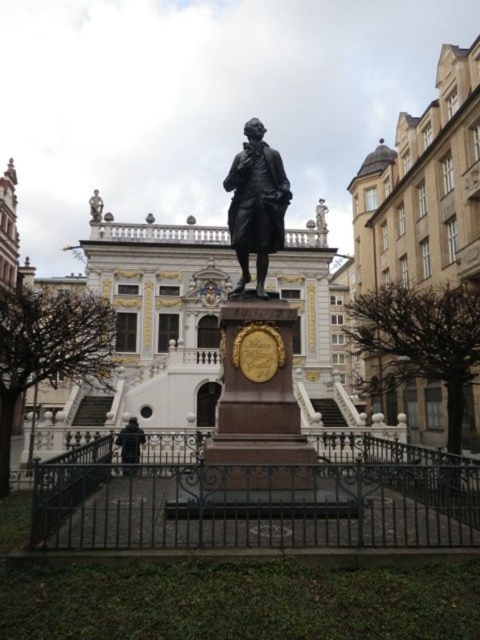
You are standing in front of the statue and want to take a photo that includes both the statue and the brown stone palace at upper right. Given that your camera has a 60 degree field of view, can you estimate whether both objects will fit in the frame?

The brown stone palace at upper right is positioned at point (423, 189). Since the camera has a 60 degree field of view, it is possible to capture both the statue and the palace within the frame as they are positioned within the angle coverage.